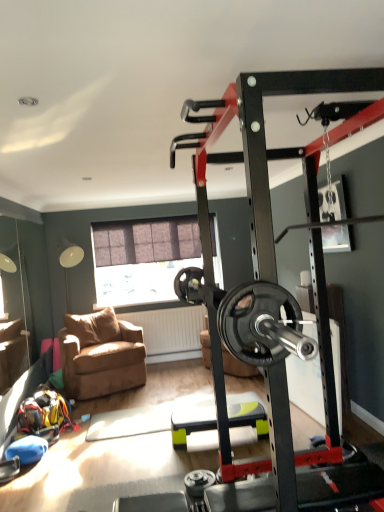
The image size is (384, 512). What do you see at coordinates (257, 322) in the screenshot?
I see `black rubber weight at center` at bounding box center [257, 322].

Describe the element at coordinates (191, 423) in the screenshot. This screenshot has height=512, width=384. I see `green plastic step platform at center` at that location.

What is the approximate width of green plastic step platform at center?

It is 31.52 inches.

The image size is (384, 512). I want to click on black rubber weight at center, so tap(257, 322).

Is matte brown window at center not close to brown fabric chair at lower left?

Indeed, matte brown window at center is not near brown fabric chair at lower left.

From a real-world perspective, which object stands above the other?

matte brown window at center, from a real-world perspective.

You are a GUI agent. You are given a task and a screenshot of the screen. Output one action in this format:
    pyautogui.click(x=<x>, y=<y>)
    Task: Click on the window that appears above the brown fabric chair at lower left (from the image's perspective)
    The width and height of the screenshot is (384, 512).
    Given the screenshot: What is the action you would take?
    pyautogui.click(x=142, y=259)

Considering the sizes of objects matte brown window at center and brown fabric chair at lower left in the image provided, who is wider, matte brown window at center or brown fabric chair at lower left?

With larger width is brown fabric chair at lower left.

Can you confirm if brown fabric chair at lower left is wider than black rubber weight at center?

No, brown fabric chair at lower left is not wider than black rubber weight at center.

Is brown fabric chair at lower left taller or shorter than black rubber weight at center?

brown fabric chair at lower left is shorter than black rubber weight at center.

From the image's perspective, is brown fabric chair at lower left on top of black rubber weight at center?

No, from the image's perspective, brown fabric chair at lower left is not on top of black rubber weight at center.

Is brown fabric chair at lower left positioned with its back to black rubber weight at center?

No, brown fabric chair at lower left's orientation is not away from black rubber weight at center.

I want to click on furniture located below the matte brown window at center (from the image's perspective), so [x=191, y=423].

Is matte brown window at center far away from green plastic step platform at center?

matte brown window at center is far away from green plastic step platform at center.

Between matte brown window at center and green plastic step platform at center, which one has less height?

green plastic step platform at center is shorter.

From the picture: Does matte brown window at center come in front of green plastic step platform at center?

No.

Can you confirm if brown fabric chair at lower left is wider than matte brown window at center?

Correct, the width of brown fabric chair at lower left exceeds that of matte brown window at center.

Is brown fabric chair at lower left at the left side of matte brown window at center?

Yes, brown fabric chair at lower left is to the left of matte brown window at center.

Based on the photo, how different are the orientations of brown fabric chair at lower left and matte brown window at center in degrees?

The angle between the facing direction of brown fabric chair at lower left and the facing direction of matte brown window at center is 22.1 degrees.

From the image's perspective, between brown fabric chair at lower left and matte brown window at center, who is located below?

brown fabric chair at lower left is shown below in the image.

From a real-world perspective, between black rubber weight at center and brown fabric chair at lower left, who is vertically lower?

brown fabric chair at lower left is physically lower.

From the image's perspective, would you say black rubber weight at center is shown under brown fabric chair at lower left?

No, from the image's perspective, black rubber weight at center is not below brown fabric chair at lower left.

Is black rubber weight at center in contact with brown fabric chair at lower left?

No, black rubber weight at center is not making contact with brown fabric chair at lower left.

Where is `wheel behind the brown fabric chair at lower left`? This screenshot has height=512, width=384. wheel behind the brown fabric chair at lower left is located at coordinates (257, 322).

Do you think green plastic step platform at center is within black rubber weight at center, or outside of it?

green plastic step platform at center is not inside black rubber weight at center, it's outside.

Considering the relative sizes of green plastic step platform at center and black rubber weight at center in the image provided, is green plastic step platform at center thinner than black rubber weight at center?

Yes.

Measure the distance from green plastic step platform at center to black rubber weight at center.

green plastic step platform at center and black rubber weight at center are 7.73 feet apart.

From the image's perspective, is green plastic step platform at center above black rubber weight at center?

No.

From the image's perspective, is black rubber weight at center beneath matte brown window at center?

Indeed, from the image's perspective, black rubber weight at center is shown beneath matte brown window at center.

Can you confirm if black rubber weight at center is thinner than matte brown window at center?

Incorrect, the width of black rubber weight at center is not less than that of matte brown window at center.

From a real-world perspective, which object rests below the other?

In real-world perspective, black rubber weight at center is lower.

Considering the sizes of black rubber weight at center and matte brown window at center in the image, is black rubber weight at center bigger or smaller than matte brown window at center?

black rubber weight at center is bigger than matte brown window at center.

In the image, there is a brown fabric chair at lower left. Where is `window above it (from the image's perspective)`? The height and width of the screenshot is (512, 384). window above it (from the image's perspective) is located at coordinates (142, 259).

This screenshot has height=512, width=384. I want to click on wheel that appears above the brown fabric chair at lower left (from a real-world perspective), so click(x=257, y=322).

From the image, which object appears to be nearer to green plastic step platform at center, brown fabric chair at lower left or matte brown window at center?

Among the two, brown fabric chair at lower left is located nearer to green plastic step platform at center.

Considering their positions, is brown fabric chair at lower left positioned closer to black rubber weight at center than matte brown window at center?

brown fabric chair at lower left.

Estimate the real-world distances between objects in this image. Which object is further from black rubber weight at center, matte brown window at center or green plastic step platform at center?

Among the two, matte brown window at center is located further to black rubber weight at center.

From the image, which object appears to be farther from matte brown window at center, black rubber weight at center or brown fabric chair at lower left?

black rubber weight at center is positioned further to the anchor matte brown window at center.

Based on their spatial positions, is black rubber weight at center or green plastic step platform at center further from matte brown window at center?

black rubber weight at center is further to matte brown window at center.

Considering their positions, is matte brown window at center positioned further to green plastic step platform at center than black rubber weight at center?

black rubber weight at center is further to green plastic step platform at center.

Considering their positions, is brown fabric chair at lower left positioned further to matte brown window at center than black rubber weight at center?

black rubber weight at center lies further to matte brown window at center than the other object.

Considering their positions, is green plastic step platform at center positioned closer to brown fabric chair at lower left than black rubber weight at center?

green plastic step platform at center.

Locate an element on the screen. window between brown fabric chair at lower left and black rubber weight at center is located at coordinates (142, 259).

Where is `wheel between green plastic step platform at center and matte brown window at center along the z-axis`? The width and height of the screenshot is (384, 512). wheel between green plastic step platform at center and matte brown window at center along the z-axis is located at coordinates (257, 322).

Locate an element on the screen. The height and width of the screenshot is (512, 384). furniture between brown fabric chair at lower left and black rubber weight at center from left to right is located at coordinates (191, 423).

Find the location of a particular element. Image resolution: width=384 pixels, height=512 pixels. chair between green plastic step platform at center and matte brown window at center along the z-axis is located at coordinates (101, 355).